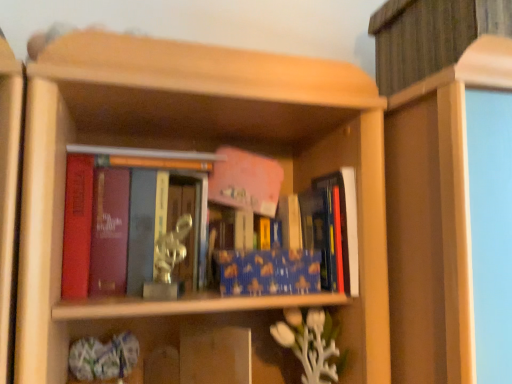
Question: Considering the positions of metallic silver statue at center and metallic statue at center, the second book when ordered from right to left, in the image, is metallic silver statue at center taller or shorter than metallic statue at center, the second book when ordered from right to left,?

Choices:
 (A) tall
 (B) short

Answer: (B)

Question: Is point (185, 185) closer or farther from the camera than point (62, 276)?

Choices:
 (A) farther
 (B) closer

Answer: (A)

Question: Which object is the farthest from the metallic silver statue at center?

Choices:
 (A) blue glossy book at center, which ranks as the second book in left-to-right order
 (B) metallic statue at center, arranged as the 1th book when viewed from the left

Answer: (A)

Question: Estimate the real-world distances between objects in this image. Which object is closer to the metallic statue at center, the second book when ordered from right to left?

Choices:
 (A) metallic silver statue at center
 (B) blue glossy book at center, which ranks as the second book in left-to-right order

Answer: (A)